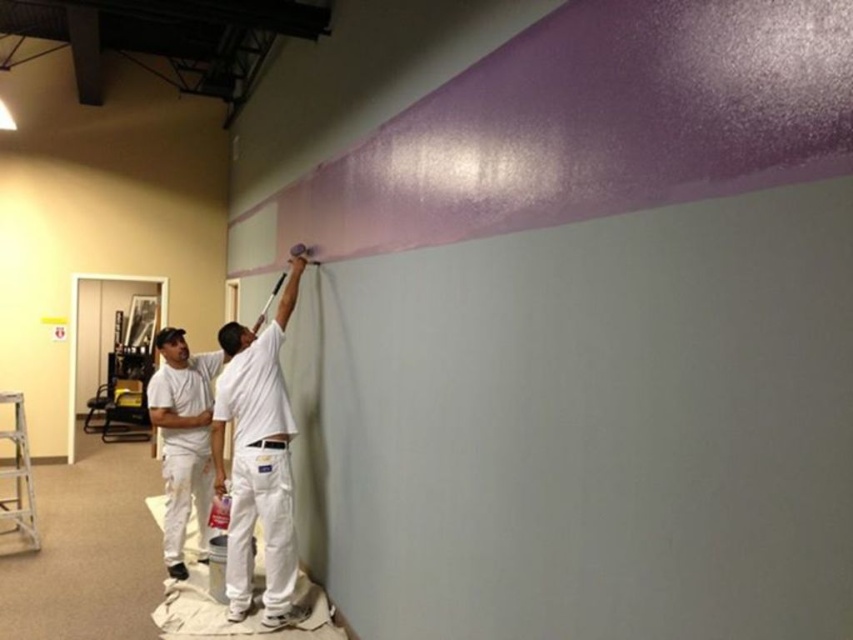
You are standing in the room and want to locate the white matte shirt at upper center. According to the coordinates provided, where should you look?

The white matte shirt at upper center is located at the coordinates point (257, 460).

You are a painter standing at the center of the room. You need to reach the white matte paint at lower left and the aluminum metallic ladder at lower left. Which one is closer to you?

The white matte paint at lower left and the aluminum metallic ladder at lower left are both at the same location since they are both at lower left. However, according to the description, the white matte paint at lower left is 4.78 feet away from the aluminum metallic ladder at lower left, so their distances from you would depend on their specific positions relative to your location. Since both are at lower left, it is unclear which is closer without more precise information.

You are a painter standing in the room and need to reach the white matte paint at lower left and the aluminum metallic ladder at lower left. Which object is nearer to you?

The white matte paint at lower left is closer to the viewer than the aluminum metallic ladder at lower left, so the white matte paint at lower left is nearer.